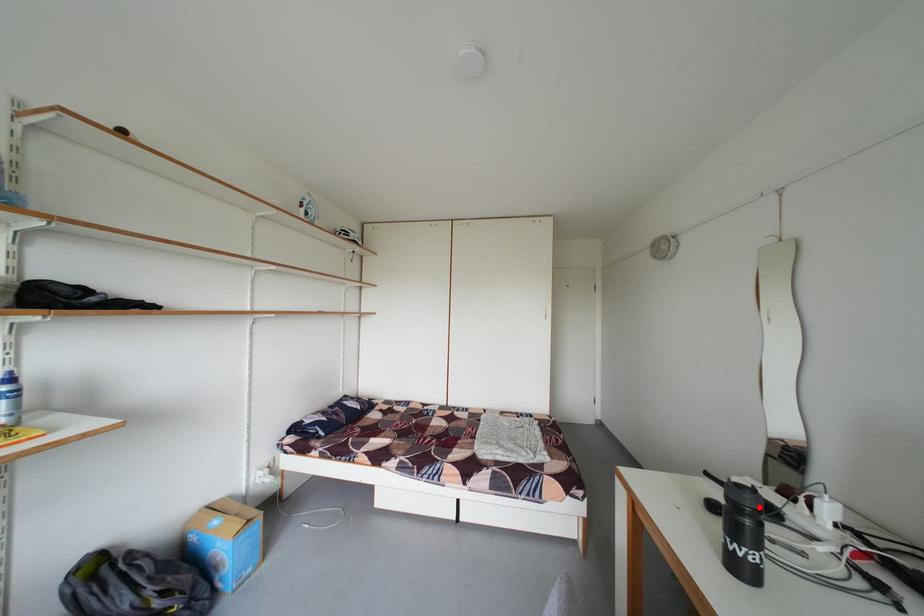
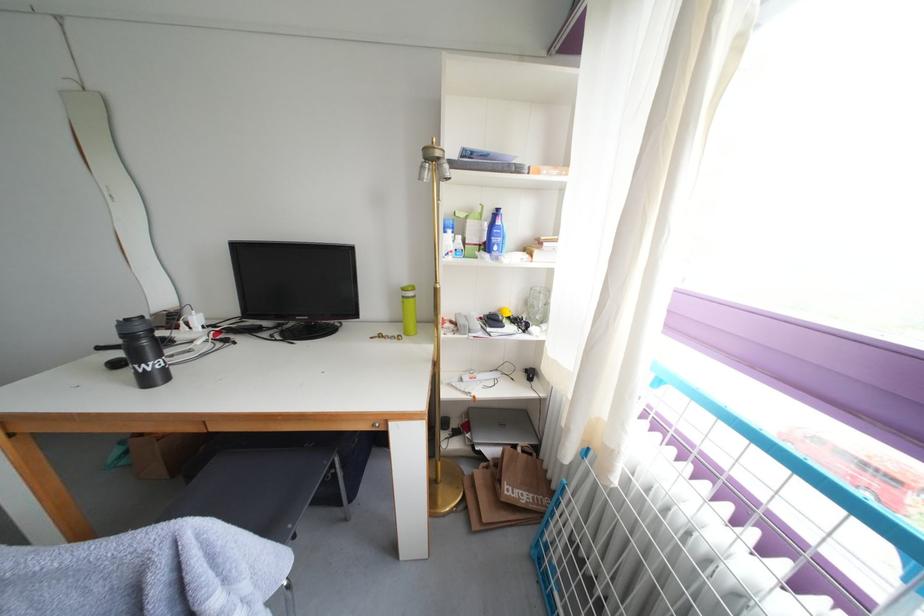
Question: I am providing you with two images of the same scene from different viewpoints. In image1, a red point is highlighted. Considering the same 3D point in image2, which of the following is correct?

Choices:
 (A) It is closer
 (B) It is farther

Answer: (B)